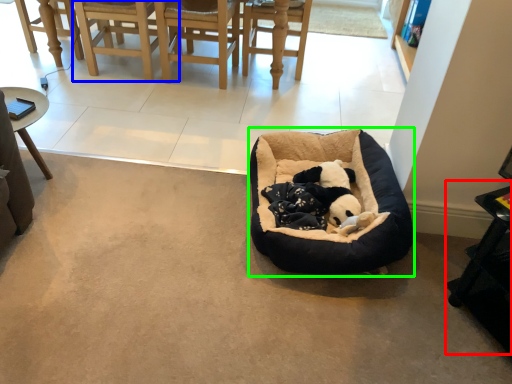
Question: Considering the real-world distances, which object is closest to table (highlighted by a red box)? chair (highlighted by a blue box) or dog bed (highlighted by a green box).

Choices:
 (A) chair
 (B) dog bed

Answer: (B)